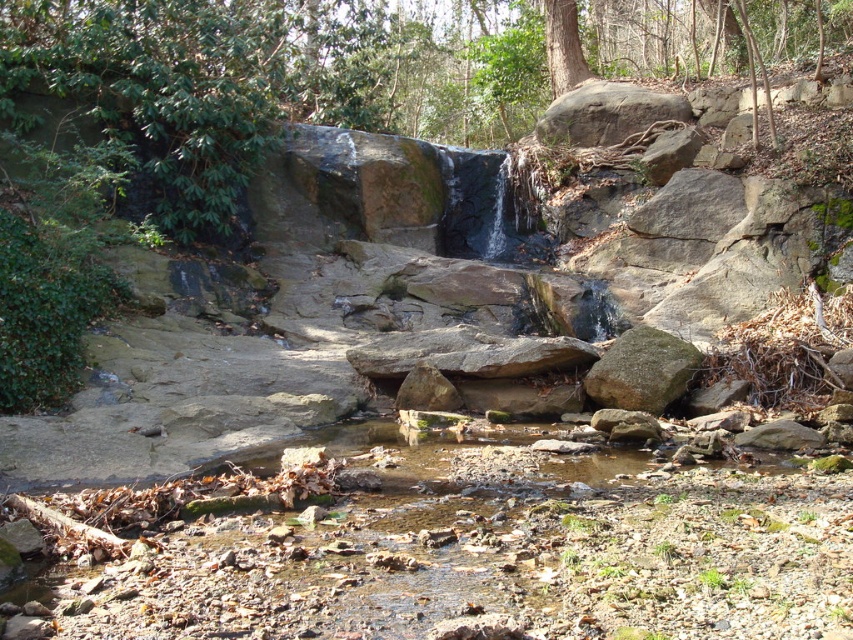
Who is positioned more to the left, green leafy tree at upper center or green mossy rock at center-right?

Positioned to the left is green leafy tree at upper center.

Can you confirm if green leafy tree at upper center is smaller than green mossy rock at center-right?

No.

Who is more distant from viewer, (x=228, y=92) or (x=621, y=394)?

Point (x=228, y=92)

Identify the location of green leafy tree at upper center. This screenshot has height=640, width=853. (270, 77).